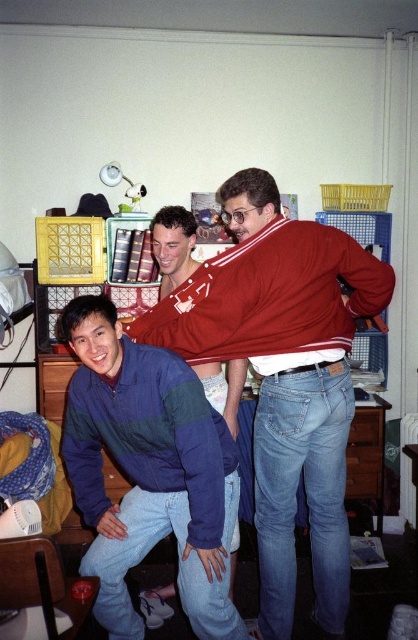
Between blue-green striped jacket at lower left and matte wood drawer at lower right, which one is positioned higher?

blue-green striped jacket at lower left is above.

In the scene shown: Is blue-green striped jacket at lower left to the right of matte wood drawer at lower right from the viewer's perspective?

Incorrect, blue-green striped jacket at lower left is not on the right side of matte wood drawer at lower right.

Does point (81, 460) come behind point (374, 428)?

No, it is in front of (374, 428).

Locate an element on the screen. blue-green striped jacket at lower left is located at coordinates (148, 472).

Can you confirm if wooden drawer at lower right is positioned to the left of matte wood drawer at lower right?

Yes, wooden drawer at lower right is to the left of matte wood drawer at lower right.

Where is `wooden drawer at lower right`? This screenshot has width=418, height=640. wooden drawer at lower right is located at coordinates (364, 454).

What do you see at coordinates (283, 376) in the screenshot? I see `matte red sweater at center` at bounding box center [283, 376].

Is point (272, 356) positioned after point (231, 442)?

Yes, it is.

This screenshot has height=640, width=418. What are the coordinates of `matte red sweater at center` in the screenshot? It's located at (283, 376).